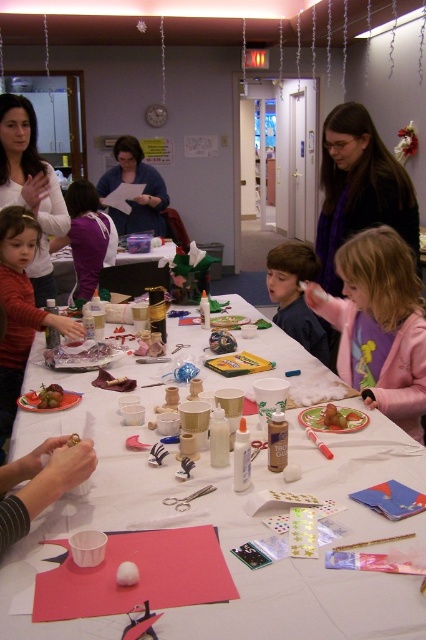
Question: Can you confirm if purple scarf at upper right is positioned to the left of smooth chocolate cake at lower center?

Choices:
 (A) no
 (B) yes

Answer: (A)

Question: Among these objects, which one is farthest from the camera?

Choices:
 (A) pink fleece jacket at lower right
 (B) matte blue sweater at upper center
 (C) smooth chocolate cake at lower center

Answer: (B)

Question: Can you confirm if matte red sweater at center is positioned to the left of purple fleece jacket at upper left?

Choices:
 (A) yes
 (B) no

Answer: (B)

Question: Is pink fleece jacket at lower right smaller than purple fleece jacket at upper left?

Choices:
 (A) no
 (B) yes

Answer: (B)

Question: Among these objects, which one is nearest to the camera?

Choices:
 (A) purple fleece jacket at upper left
 (B) pink fleece jacket at lower right
 (C) green matte grapes at center
 (D) purple scarf at upper right

Answer: (B)

Question: Which object is the closest to the purple fleece jacket at upper left?

Choices:
 (A) pink fleece jacket at lower right
 (B) matte white sweater at upper left
 (C) brown hair boy at center

Answer: (B)